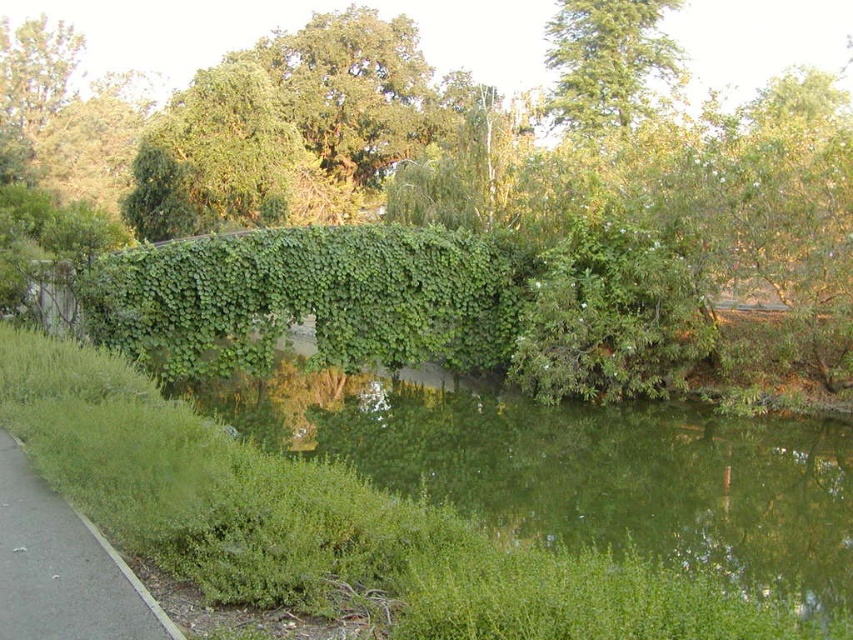
Question: Does green leafy river at center appear on the right side of green leafy hedge at center?

Choices:
 (A) no
 (B) yes

Answer: (B)

Question: Which point is closer to the camera?

Choices:
 (A) green grass at lower left
 (B) green leafy river at center
 (C) green leafy tree at center

Answer: (A)

Question: Which object appears farthest from the camera in this image?

Choices:
 (A) green grass at lower left
 (B) green leafy hedge at center

Answer: (B)

Question: Where is green leafy river at center located in relation to green leafy tree at center in the image?

Choices:
 (A) below
 (B) above

Answer: (A)

Question: Can you confirm if green leafy hedge at center is positioned above green grass at lower left?

Choices:
 (A) yes
 (B) no

Answer: (A)

Question: Which object appears farthest from the camera in this image?

Choices:
 (A) green leafy hedge at center
 (B) green leafy river at center

Answer: (A)